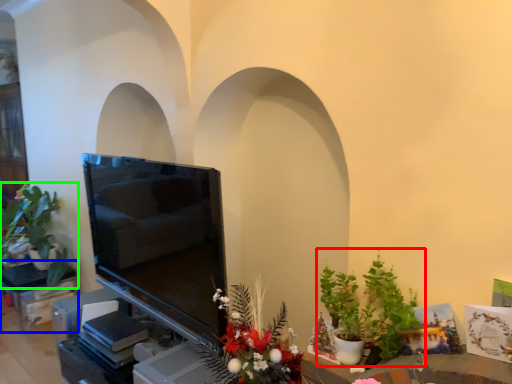
Question: Estimate the real-world distances between objects in this image. Which object is farther from houseplant (highlighted by a red box), furniture (highlighted by a blue box) or houseplant (highlighted by a green box)?

Choices:
 (A) furniture
 (B) houseplant

Answer: (A)